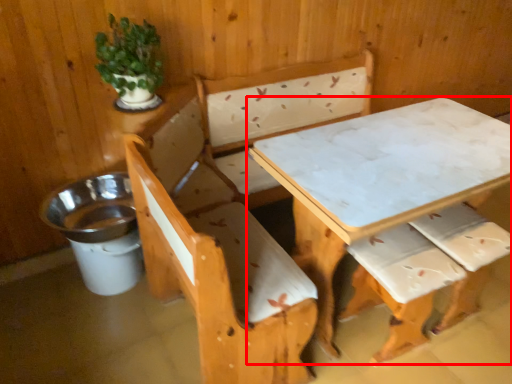
Question: Observing the image, what is the correct spatial positioning of table (annotated by the red box) in reference to houseplant?

Choices:
 (A) left
 (B) right

Answer: (B)